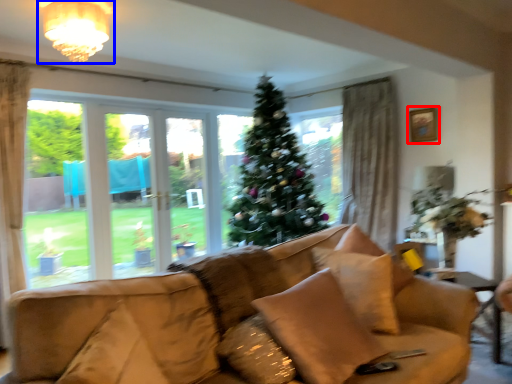
Question: Which of the following is the farthest to the observer, picture frame (highlighted by a red box) or light fixture (highlighted by a blue box)?

Choices:
 (A) picture frame
 (B) light fixture

Answer: (A)